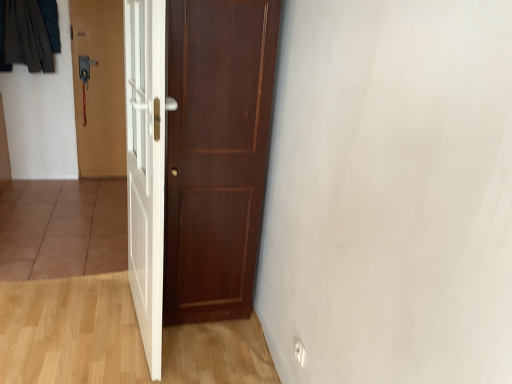
Find the location of a particular element. This screenshot has height=384, width=512. free location in front of matte wood door at center, which is the 3th door in left-to-right order is located at coordinates (198, 354).